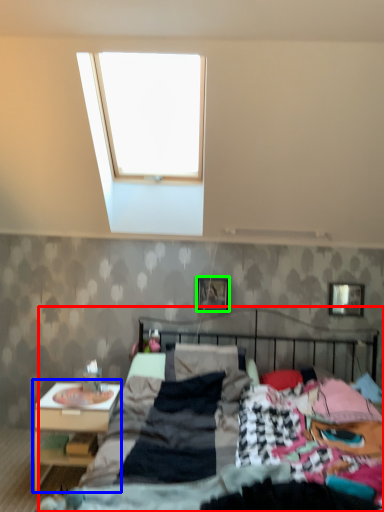
Question: Which is nearer to the bed (highlighted by a red box)? nightstand (highlighted by a blue box) or picture frame (highlighted by a green box).

Choices:
 (A) nightstand
 (B) picture frame

Answer: (A)